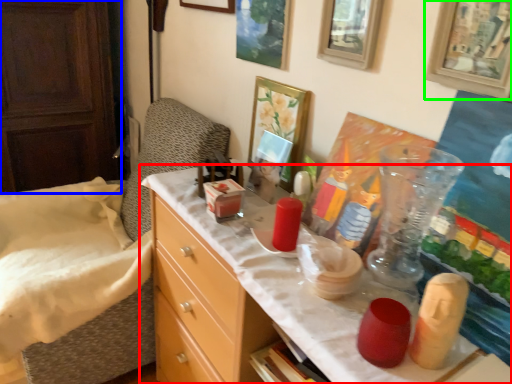
Question: Which is nearer to the desk (highlighted by a red box)? dresser (highlighted by a blue box) or picture frame (highlighted by a green box).

Choices:
 (A) dresser
 (B) picture frame

Answer: (B)